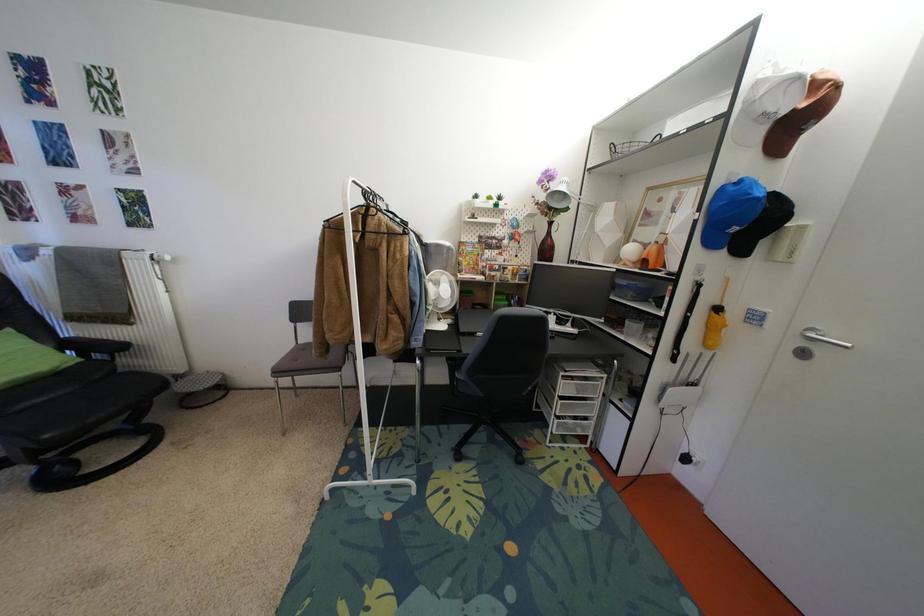
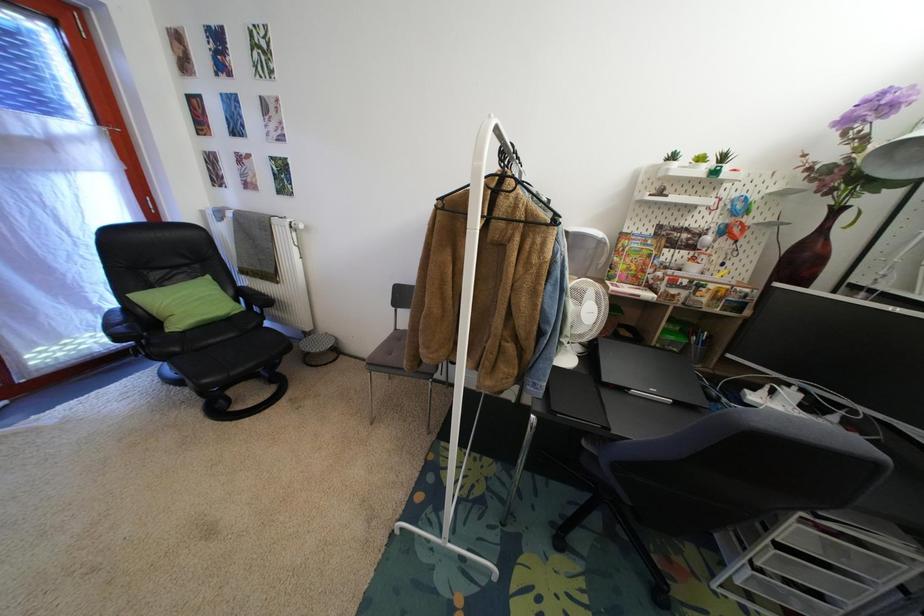
In the scene shown: In a continuous first-person perspective shot, in which direction is the camera moving?

The movement direction of the cameraman is left, forward.